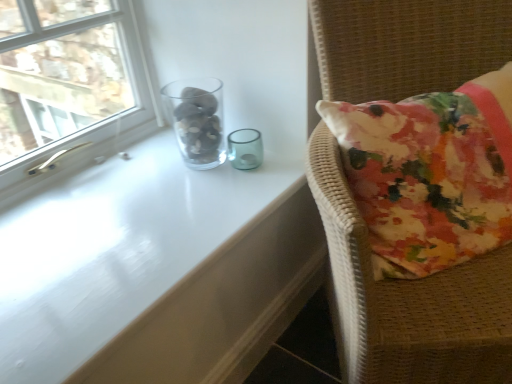
This screenshot has height=384, width=512. Identify the location of vacant area situated to the left side of transparent glass vase at upper left. (142, 168).